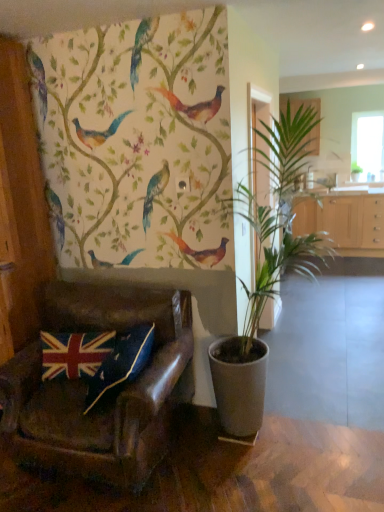
Question: Does light wood cabinet at center, which appears as the second cabinetry when viewed from the top, have a larger size compared to blue velvet pillow at lower left, the 1th pillow when ordered from right to left?

Choices:
 (A) no
 (B) yes

Answer: (B)

Question: Are light wood cabinet at center, the 1th cabinetry when ordered from bottom to top, and blue velvet pillow at lower left, the 1th pillow when ordered from right to left, far apart?

Choices:
 (A) yes
 (B) no

Answer: (A)

Question: From a real-world perspective, is light wood cabinet at center, which appears as the second cabinetry when viewed from the top, on top of blue velvet pillow at lower left, the 1th pillow when ordered from right to left?

Choices:
 (A) no
 (B) yes

Answer: (A)

Question: Is light wood cabinet at center, the 1th cabinetry when ordered from bottom to top, with blue velvet pillow at lower left, acting as the second pillow starting from the left?

Choices:
 (A) no
 (B) yes

Answer: (A)

Question: Does light wood cabinet at center, which appears as the second cabinetry when viewed from the top, have a greater width compared to blue velvet pillow at lower left, acting as the second pillow starting from the left?

Choices:
 (A) yes
 (B) no

Answer: (A)

Question: Can you confirm if light wood cabinet at center, which appears as the second cabinetry when viewed from the top, is positioned to the right of blue velvet pillow at lower left, acting as the second pillow starting from the left?

Choices:
 (A) no
 (B) yes

Answer: (B)

Question: Is light wood cabinet at center, the 1th cabinetry when ordered from bottom to top, oriented towards wooden cabinet at upper right, the second cabinetry from the bottom?

Choices:
 (A) no
 (B) yes

Answer: (A)

Question: Can you confirm if light wood cabinet at center, which appears as the second cabinetry when viewed from the top, is smaller than wooden cabinet at upper right, the second cabinetry from the bottom?

Choices:
 (A) yes
 (B) no

Answer: (B)

Question: Is light wood cabinet at center, which appears as the second cabinetry when viewed from the top, at the left side of wooden cabinet at upper right, which is the 1th cabinetry in top-to-bottom order?

Choices:
 (A) no
 (B) yes

Answer: (A)

Question: Does light wood cabinet at center, which appears as the second cabinetry when viewed from the top, have a lesser height compared to wooden cabinet at upper right, the second cabinetry from the bottom?

Choices:
 (A) yes
 (B) no

Answer: (B)

Question: Is light wood cabinet at center, which appears as the second cabinetry when viewed from the top, oriented away from wooden cabinet at upper right, the second cabinetry from the bottom?

Choices:
 (A) yes
 (B) no

Answer: (B)

Question: Is light wood cabinet at center, the 1th cabinetry when ordered from bottom to top, taller than wooden cabinet at upper right, the second cabinetry from the bottom?

Choices:
 (A) no
 (B) yes

Answer: (B)

Question: Is the position of transparent glass window at upper right more distant than that of light wood cabinet at center, the 1th cabinetry when ordered from bottom to top?

Choices:
 (A) no
 (B) yes

Answer: (B)